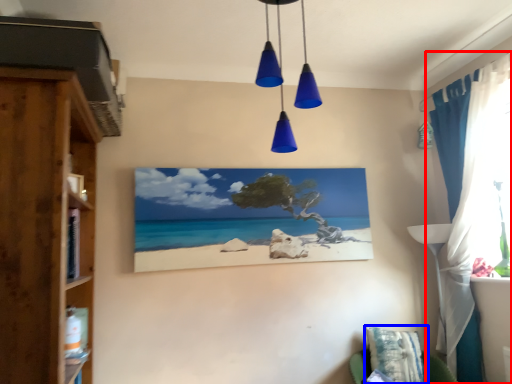
Question: Among these objects, which one is farthest to the camera, curtain (highlighted by a red box) or pillow (highlighted by a blue box)?

Choices:
 (A) curtain
 (B) pillow

Answer: (B)